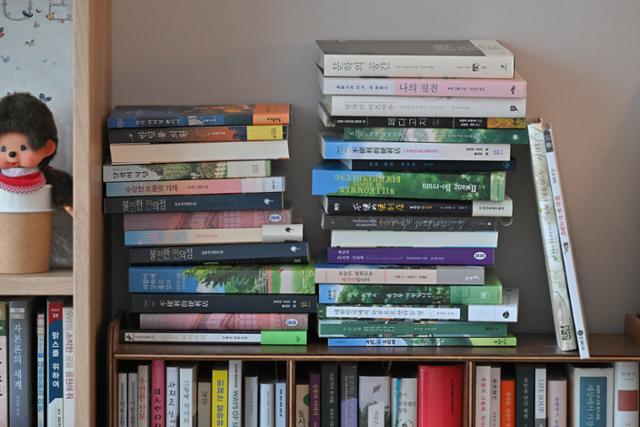
Identify the location of books on left bottom shelf. (70, 379), (52, 397), (41, 413), (19, 414), (1, 414).